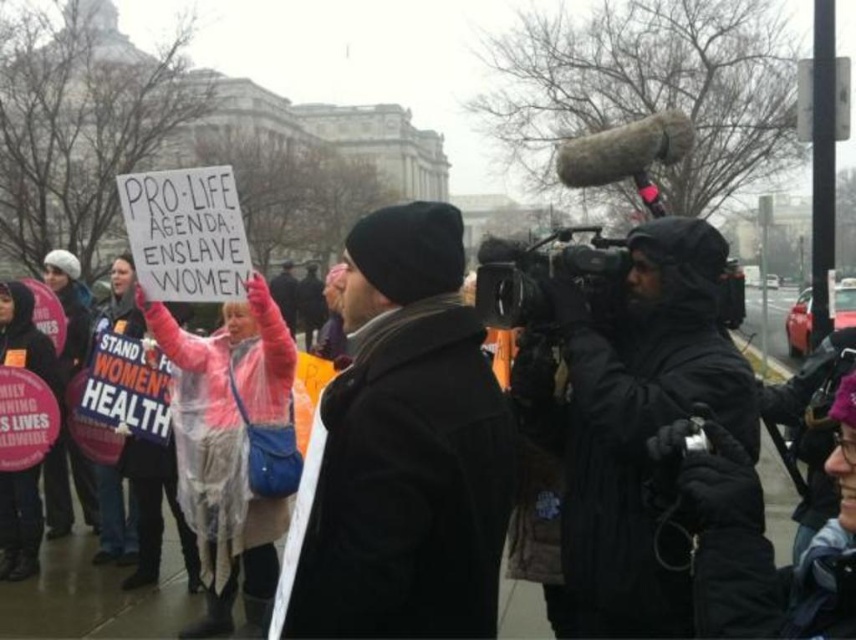
Question: Which object is closer to the camera taking this photo?

Choices:
 (A) pink waterproof jacket at center
 (B) black woolen hat at center

Answer: (B)

Question: Is black woolen hat at center closer to camera compared to pink waterproof jacket at center?

Choices:
 (A) yes
 (B) no

Answer: (A)

Question: Does black woolen hat at center have a lesser width compared to pink waterproof jacket at center?

Choices:
 (A) no
 (B) yes

Answer: (A)

Question: Among these objects, which one is farthest from the camera?

Choices:
 (A) pink waterproof jacket at center
 (B) black woolen hat at center

Answer: (A)

Question: Does black woolen hat at center have a larger size compared to pink waterproof jacket at center?

Choices:
 (A) yes
 (B) no

Answer: (B)